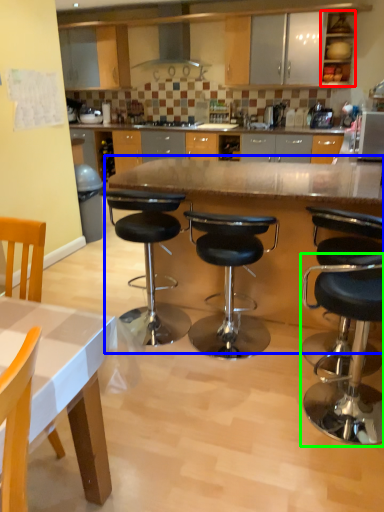
Question: Which object is positioned closest to cabinetry (highlighted by a red box)? Select from table (highlighted by a blue box) and stool (highlighted by a green box).

Choices:
 (A) table
 (B) stool

Answer: (A)